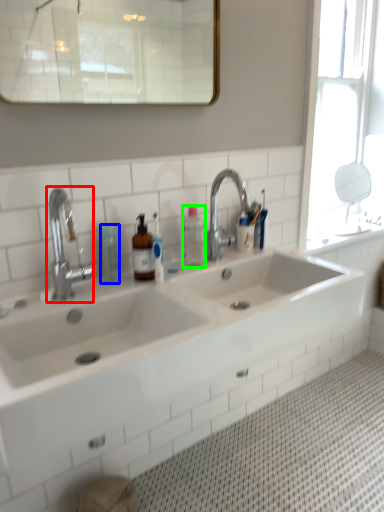
Question: Considering the real-world distances, which object is closest to tap (highlighted by a red box)? toiletry (highlighted by a blue box) or bottle (highlighted by a green box).

Choices:
 (A) toiletry
 (B) bottle

Answer: (A)